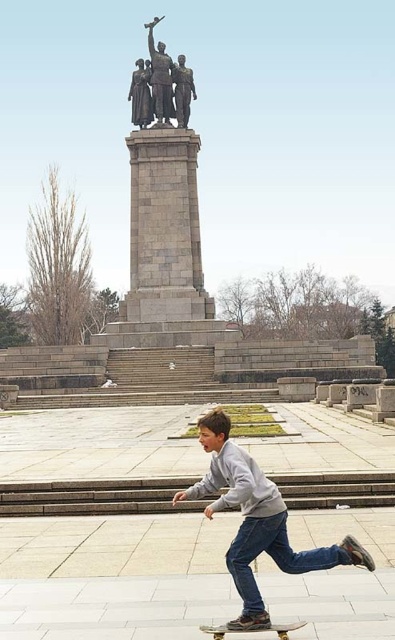
Question: Estimate the real-world distances between objects in this image. Which object is closer to the gray sweatshirt at lower center?

Choices:
 (A) bronze statue at center
 (B) polished bronze statue at upper center
 (C) polished bronze statue at center

Answer: (C)

Question: Estimate the real-world distances between objects in this image. Which object is closer to the gray sweatshirt at lower center?

Choices:
 (A) polished bronze statue at upper center
 (B) polished bronze statue at center
 (C) wooden skateboard at lower center
 (D) bronze statue at center

Answer: (C)

Question: Is gray sweatshirt at lower center wider than bronze statue at center?

Choices:
 (A) yes
 (B) no

Answer: (A)

Question: Considering the relative positions of gray sweatshirt at lower center and polished bronze statue at upper center in the image provided, where is gray sweatshirt at lower center located with respect to polished bronze statue at upper center?

Choices:
 (A) right
 (B) left

Answer: (A)

Question: Is gray sweatshirt at lower center smaller than bronze statue at center?

Choices:
 (A) no
 (B) yes

Answer: (A)

Question: Among these points, which one is farthest from the camera?

Choices:
 (A) (252, 492)
 (B) (146, 124)

Answer: (B)